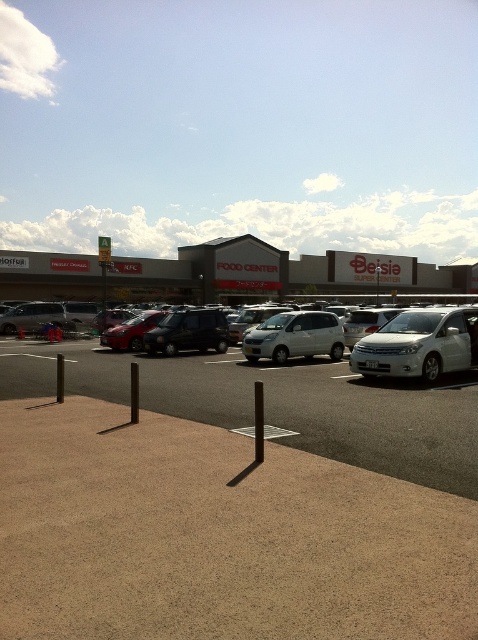
Consider the image. You are a delivery driver who needs to park your vehicle in the parking lot. You have a large delivery truck that is 6 meters long. The satin silver minivan at center and the metallic red car at center are currently parked in the spot you want to use. Can your truck fit in the space if the minivan and car are moved?

The satin silver minivan at center is smaller than the metallic red car at center, but since your truck is 6 meters long, you need to ensure the parking space is at least 6 meters. However, the description only provides relative size information between the two vehicles and does not specify the exact dimensions of the parking spot. Without knowing the exact size of the parking space, it is impossible to determine if the truck will fit.

You are standing in the parking lot and see the satin silver minivan at center and the metallic red car at center. Which vehicle is nearer to you?

The satin silver minivan at center is closer to the viewer than the metallic red car at center.

You are standing at the entrance of the parking lot and see a satin silver minivan at center. Can you tell me the location of the point with coordinates (x=294, y=337) in relation to the satin silver minivan at center?

The point with coordinates (x=294, y=337) is located on the satin silver minivan at center.